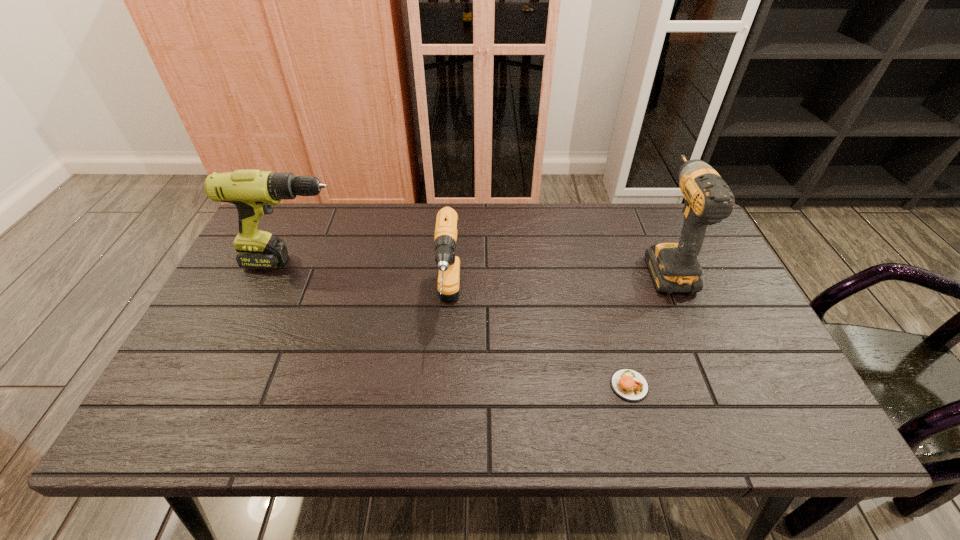
At what (x,y) coordinates should I click in order to perform the action: click on object located in the far edge section of the desktop. Please return your answer as a coordinate pair (x, y). The height and width of the screenshot is (540, 960). Looking at the image, I should click on (674, 267).

Where is `object that is positioned at the near edge`? Image resolution: width=960 pixels, height=540 pixels. object that is positioned at the near edge is located at coordinates (630, 385).

You are a GUI agent. You are given a task and a screenshot of the screen. Output one action in this format:
    pyautogui.click(x=<x>, y=<y>)
    Task: Click on the object that is at the left edge
    This screenshot has width=960, height=540.
    Given the screenshot: What is the action you would take?
    pyautogui.click(x=253, y=192)

Image resolution: width=960 pixels, height=540 pixels. Identify the location of object that is at the right edge. (674, 267).

Identify the location of object at the far right corner. (674, 267).

Find the location of a particular element. The width and height of the screenshot is (960, 540). free space at the far edge of the desktop is located at coordinates (362, 217).

Identify the location of vacant space at the near edge of the desktop. Image resolution: width=960 pixels, height=540 pixels. (517, 439).

You are a GUI agent. You are given a task and a screenshot of the screen. Output one action in this format:
    pyautogui.click(x=<x>, y=<y>)
    Task: Click on the vacant space at the left edge of the desktop
    The height and width of the screenshot is (540, 960).
    Given the screenshot: What is the action you would take?
    pyautogui.click(x=251, y=274)

This screenshot has width=960, height=540. In order to click on free space at the far left corner of the desktop in this screenshot , I will do `click(301, 244)`.

Where is `free space at the near left corner`? The image size is (960, 540). free space at the near left corner is located at coordinates (170, 429).